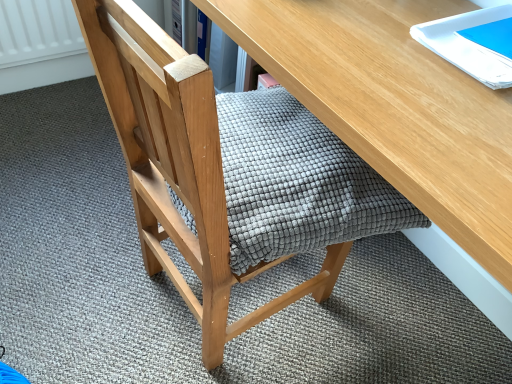
The width and height of the screenshot is (512, 384). I want to click on vacant space underneath wooden desk at center (from a real-world perspective), so click(x=384, y=316).